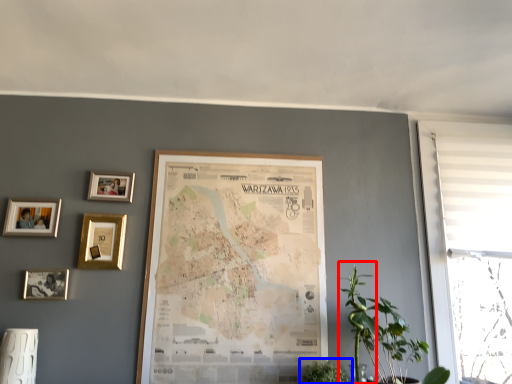
Question: Among these objects, which one is farthest to the camera, plant (highlighted by a red box) or houseplant (highlighted by a blue box)?

Choices:
 (A) plant
 (B) houseplant

Answer: (B)